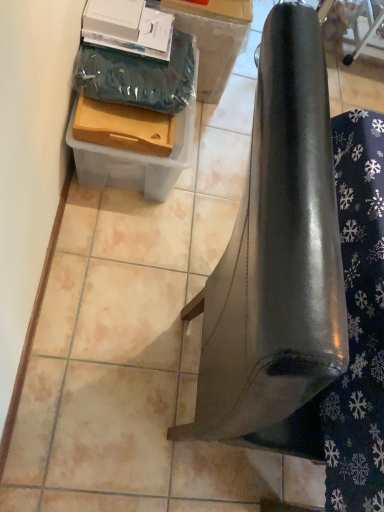
Question: Considering the positions of cardboard box at upper left, positioned as the second cardboard box in bottom-to-top order, and matte plastic box at upper left, the second cardboard box viewed from the top, in the image, is cardboard box at upper left, positioned as the second cardboard box in bottom-to-top order, taller or shorter than matte plastic box at upper left, the second cardboard box viewed from the top,?

Choices:
 (A) tall
 (B) short

Answer: (A)

Question: Considering the positions of point (178, 13) and point (148, 71), is point (178, 13) closer or farther from the camera than point (148, 71)?

Choices:
 (A) closer
 (B) farther

Answer: (B)

Question: Which of these objects is positioned closest to the matte plastic box at upper left, the second cardboard box viewed from the top?

Choices:
 (A) glossy metallic punching bag at right
 (B) wooden drawer at upper left
 (C) cardboard box at upper left, the first cardboard box in the top-to-bottom sequence

Answer: (B)

Question: Which object is the closest to the glossy metallic punching bag at right?

Choices:
 (A) cardboard box at upper left, the first cardboard box in the top-to-bottom sequence
 (B) matte plastic box at upper left, the second cardboard box viewed from the top
 (C) wooden drawer at upper left

Answer: (C)